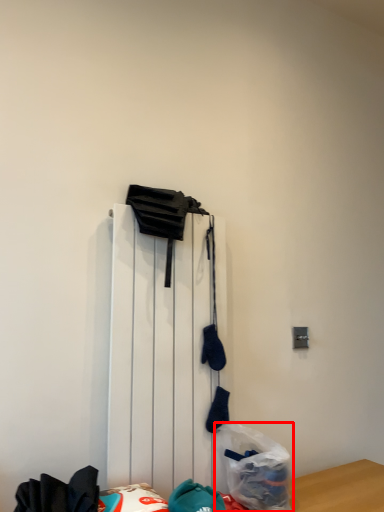
Question: From the image's perspective, what is the correct spatial relationship of plastic bag (annotated by the red box) in relation to radiator?

Choices:
 (A) above
 (B) below

Answer: (B)